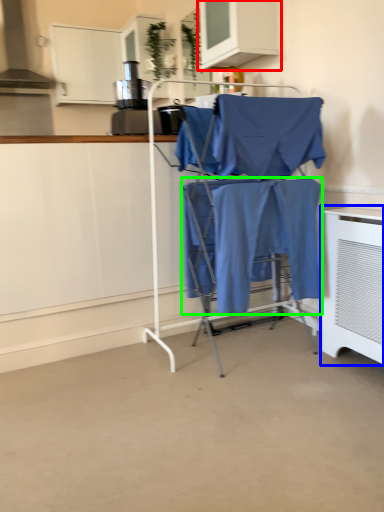
Question: Considering the real-world distances, which object is farthest from cabinetry (highlighted by a red box)? home appliance (highlighted by a blue box) or fabric (highlighted by a green box)?

Choices:
 (A) home appliance
 (B) fabric

Answer: (A)